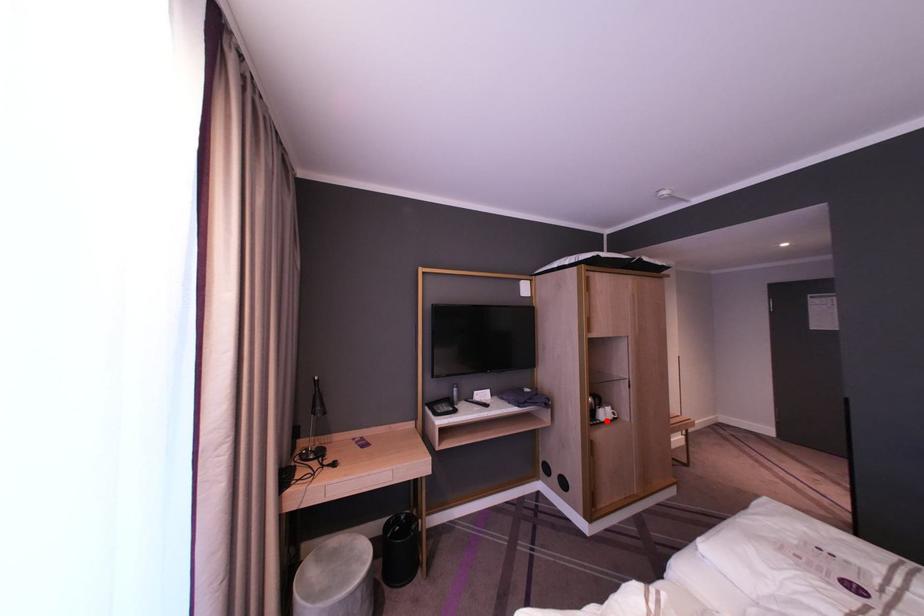
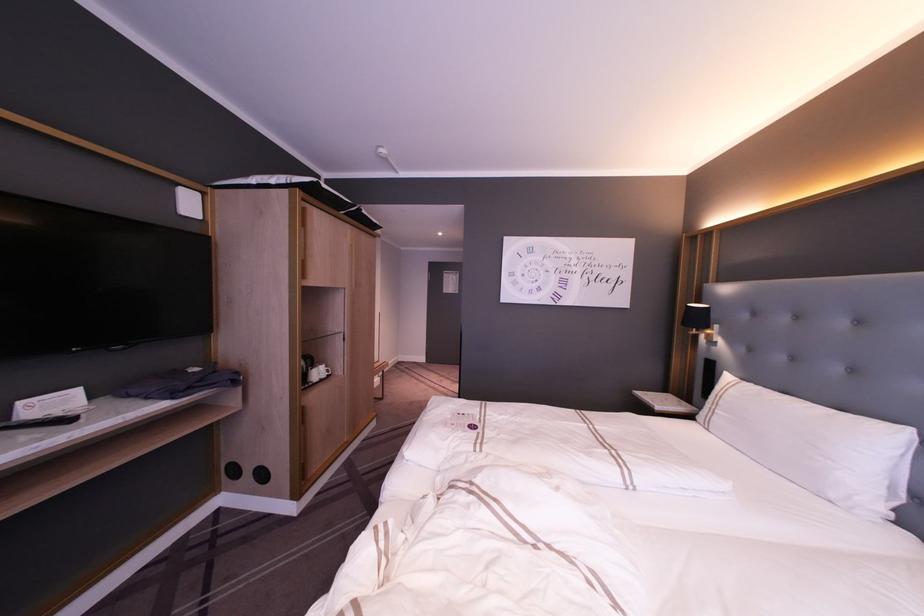
The point at the highlighted location is marked in the first image. Where is the corresponding point in the second image?

(321, 379)